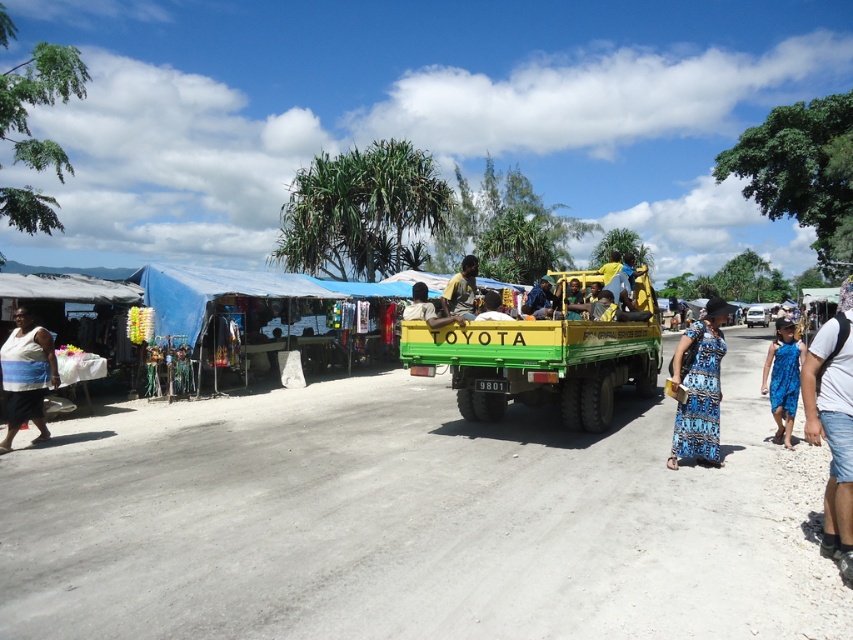
Question: Does green matte truck at center lie behind yellow fabric bag at center?

Choices:
 (A) yes
 (B) no

Answer: (B)

Question: Does blue fabric canopy at left appear under blue fabric shirt at center?

Choices:
 (A) yes
 (B) no

Answer: (B)

Question: Which is farther from the yellow fabric bag at center?

Choices:
 (A) white cotton shirt at lower right
 (B) blue fabric canopy at left

Answer: (B)

Question: Which point is closer to the camera?

Choices:
 (A) white plastic car at center
 (B) green matte truck at center
 (C) blue fabric canopy at left

Answer: (B)

Question: Does yellow-green fabric at center have a larger size compared to white plastic car at center?

Choices:
 (A) no
 (B) yes

Answer: (A)

Question: Among these points, which one is farthest from the camera?

Choices:
 (A) (279, 288)
 (B) (834, 445)

Answer: (A)